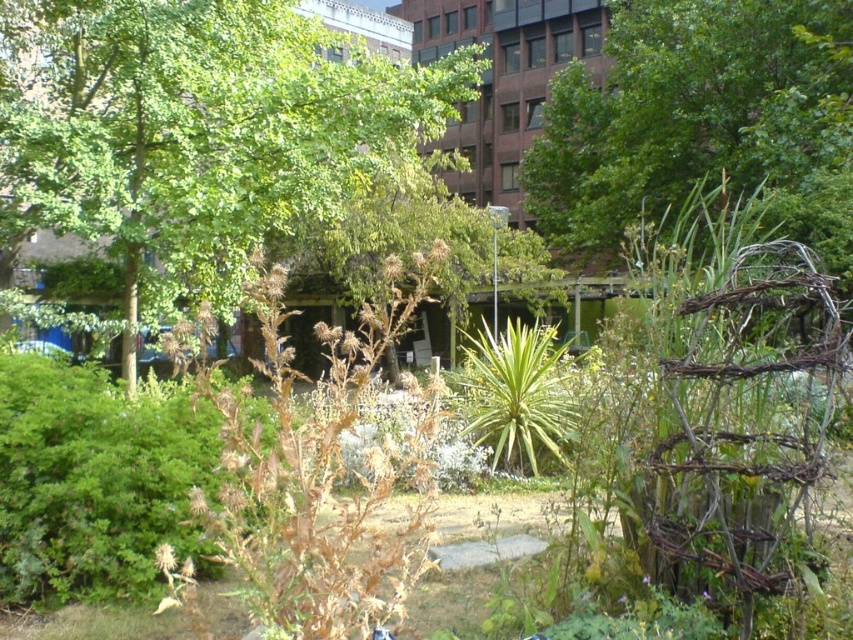
This screenshot has width=853, height=640. Describe the element at coordinates (195, 131) in the screenshot. I see `green leafy tree at upper left` at that location.

Is point (155, 76) closer to camera compared to point (469, 353)?

Yes, point (155, 76) is in front of point (469, 353).

The width and height of the screenshot is (853, 640). What do you see at coordinates (195, 131) in the screenshot? I see `green leafy tree at upper left` at bounding box center [195, 131].

Find the location of a particular element. The image size is (853, 640). green leafy tree at upper left is located at coordinates (195, 131).

Who is more forward, (167, 429) or (531, 385)?

Point (167, 429)

Does point (45, 516) lie in front of point (531, 396)?

Yes.

Image resolution: width=853 pixels, height=640 pixels. What are the coordinates of `green leafy bush at center` in the screenshot? It's located at (96, 481).

This screenshot has height=640, width=853. What are the coordinates of `green leafy tree at upper right` in the screenshot? It's located at (689, 109).

Does point (647, 35) come behind point (523, 429)?

Yes, point (647, 35) is farther from viewer.

I want to click on green leafy tree at upper right, so click(689, 109).